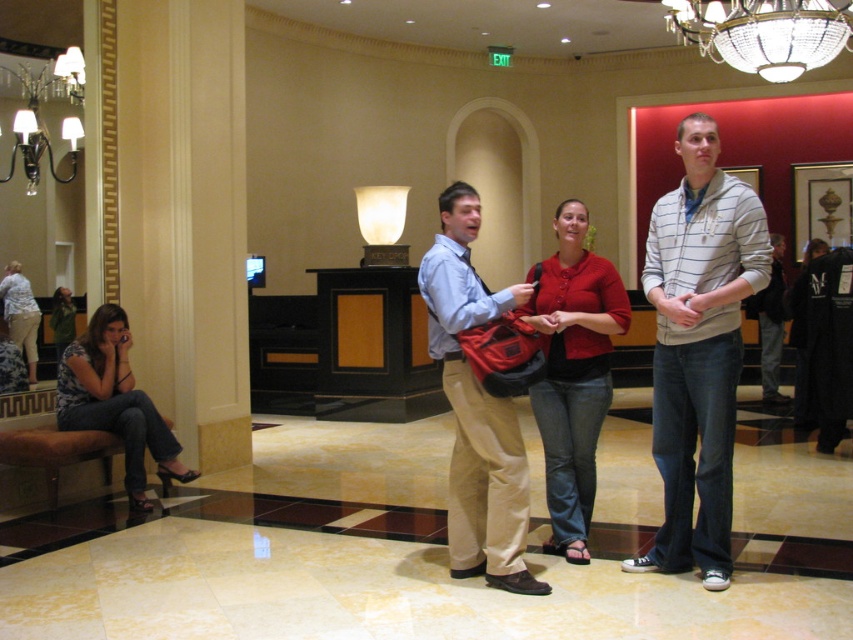
Question: Considering the real-world distances, which object is farthest from the denim jeans at left?

Choices:
 (A) crystal glass chandelier at upper center
 (B) matte silver chandelier at upper left

Answer: (A)

Question: Is striped cotton hoodie at center thinner than matte blue shirt at center?

Choices:
 (A) yes
 (B) no

Answer: (A)

Question: Which of the following is the closest to the observer?

Choices:
 (A) (563, 488)
 (B) (447, 330)
 (C) (689, 401)

Answer: (B)

Question: Does matte blue shirt at center appear on the left side of denim jeans at left?

Choices:
 (A) yes
 (B) no

Answer: (B)

Question: Can you confirm if denim jeans at left is bigger than matte silver chandelier at upper left?

Choices:
 (A) no
 (B) yes

Answer: (B)

Question: Which point is closer to the camera?

Choices:
 (A) (662, 321)
 (B) (596, 317)
 (C) (505, 477)
 (D) (67, 80)

Answer: (C)